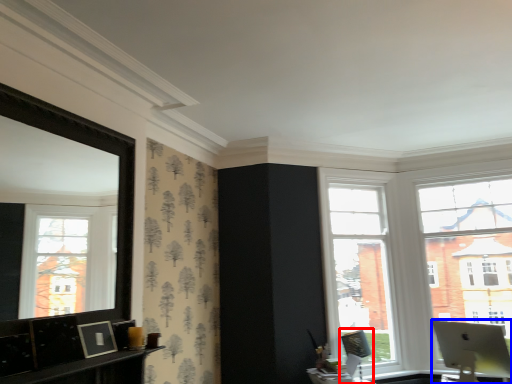
Question: Which point is closer to the camera, swivel chair (highlighted by a red box) or laptop (highlighted by a blue box)?

Choices:
 (A) swivel chair
 (B) laptop

Answer: (B)